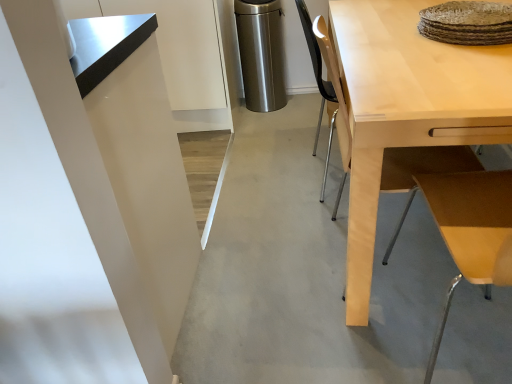
This screenshot has height=384, width=512. I want to click on free point in front of stainless steel trash can at center, so click(x=279, y=122).